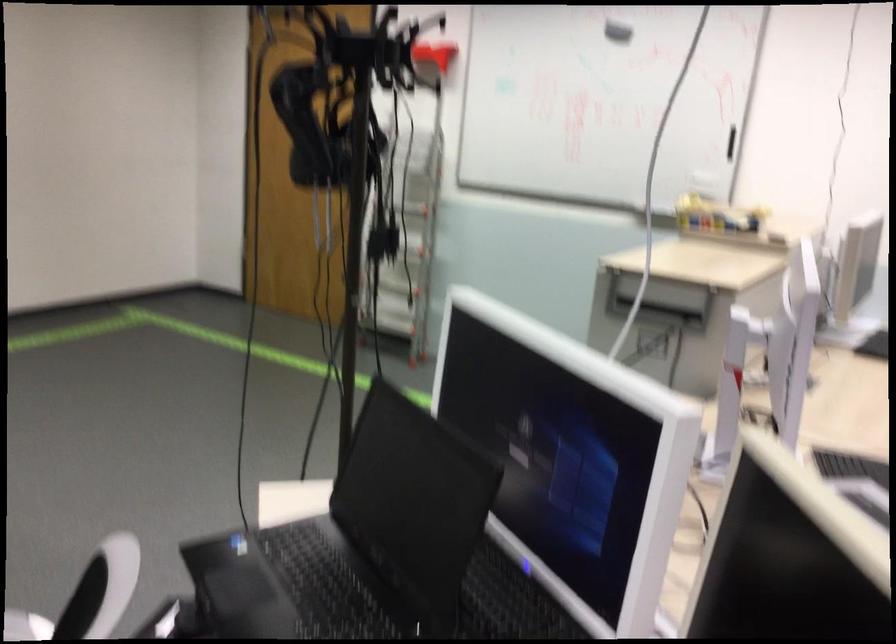
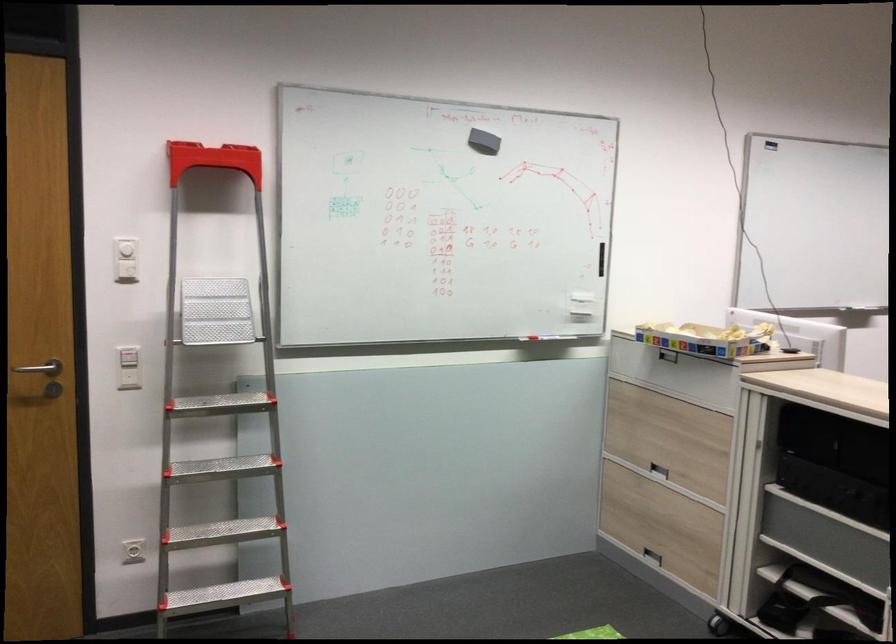
Locate, in the second image, the point that corresponds to pixel 668 202 in the first image.

(539, 337)